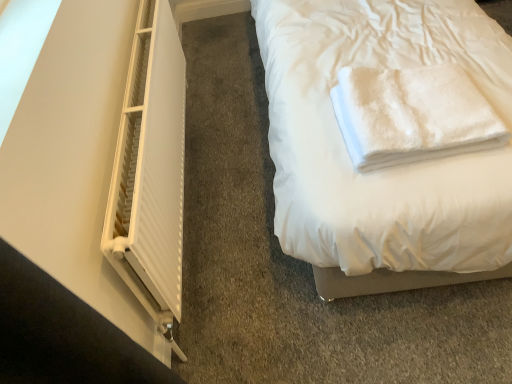
Question: In terms of width, does white matte radiator at left look wider or thinner when compared to white fluffy towel at upper right?

Choices:
 (A) wide
 (B) thin

Answer: (B)

Question: Is point (166, 157) closer or farther from the camera than point (478, 92)?

Choices:
 (A) farther
 (B) closer

Answer: (A)

Question: From the image's perspective, is white matte radiator at left positioned above or below white fluffy towel at upper right?

Choices:
 (A) above
 (B) below

Answer: (B)

Question: Considering the positions of point (346, 107) and point (162, 69), is point (346, 107) closer or farther from the camera than point (162, 69)?

Choices:
 (A) farther
 (B) closer

Answer: (B)

Question: From the image's perspective, is white fluffy towel at upper right positioned above or below white matte radiator at left?

Choices:
 (A) below
 (B) above

Answer: (B)

Question: Choose the correct answer: Is white fluffy towel at upper right inside white matte radiator at left or outside it?

Choices:
 (A) inside
 (B) outside

Answer: (B)

Question: From a real-world perspective, is white fluffy towel at upper right physically located above or below white matte radiator at left?

Choices:
 (A) above
 (B) below

Answer: (A)